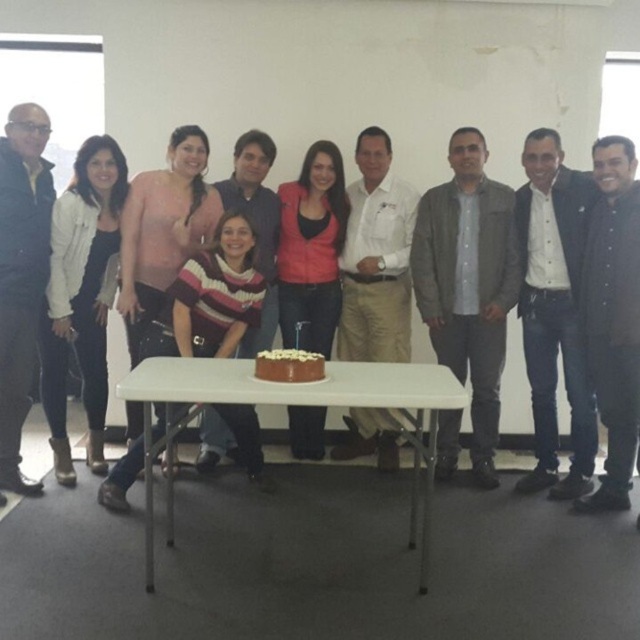
You are standing in the room and want to hand a gift to the person wearing the light brown leather jacket at center. Based on their position relative to the white folding table, can you estimate whether the jacket is closer to the table or further away?

The light brown leather jacket at center is located at point [554,310]. Since the table is at the center of the scene, the jacket is positioned closer to the table than the edges of the room, so it is closer to the table.

You are standing in the room and want to reach both the point at [413,371] and the point at [0,148]. Which point should you go to first to minimize the total distance traveled?

You should go to point [413,371] first because it is closer to you than point [0,148], so reaching it first minimizes the total distance traveled.

You are a photographer trying to capture a candid shot of the group. You notice the light brown leather jacket at center and the matte black jacket at left. Which jacket is positioned lower in the image?

The light brown leather jacket at center is located below the matte black jacket at left, so it is positioned lower in the image.